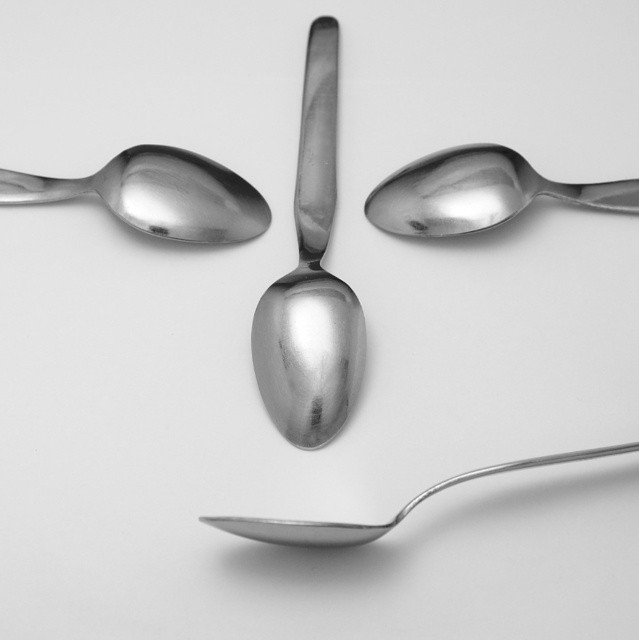
Question: Can you confirm if polished metal spoon at left is bigger than polished metal spoon at bottom?

Choices:
 (A) no
 (B) yes

Answer: (A)

Question: Which object is farther from the camera taking this photo?

Choices:
 (A) polished metal spoon at center
 (B) polished metal spoon at upper center
 (C) polished metal spoon at left
 (D) polished metal spoon at bottom

Answer: (B)

Question: Can you confirm if polished metal spoon at left is thinner than polished metal spoon at upper center?

Choices:
 (A) no
 (B) yes

Answer: (B)

Question: Observing the image, what is the correct spatial positioning of polished metal spoon at center in reference to polished metal spoon at left?

Choices:
 (A) below
 (B) above

Answer: (A)

Question: Which of the following is the closest to the observer?

Choices:
 (A) (346, 371)
 (B) (427, 225)
 (C) (180, 236)

Answer: (A)

Question: Based on their relative distances, which object is farther from the polished metal spoon at center?

Choices:
 (A) polished metal spoon at left
 (B) polished metal spoon at upper center
 (C) polished metal spoon at bottom

Answer: (C)